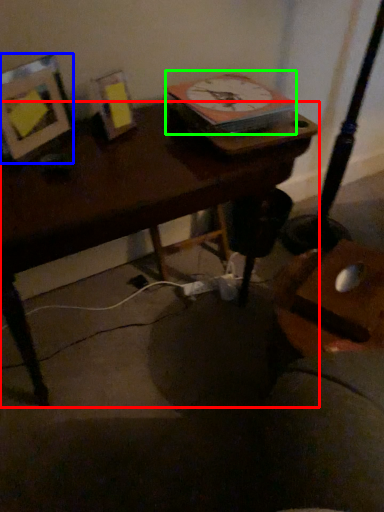
Question: Based on their relative distances, which object is nearer to desk (highlighted by a red box)? Choose from picture frame (highlighted by a blue box) and clock (highlighted by a green box).

Choices:
 (A) picture frame
 (B) clock

Answer: (A)